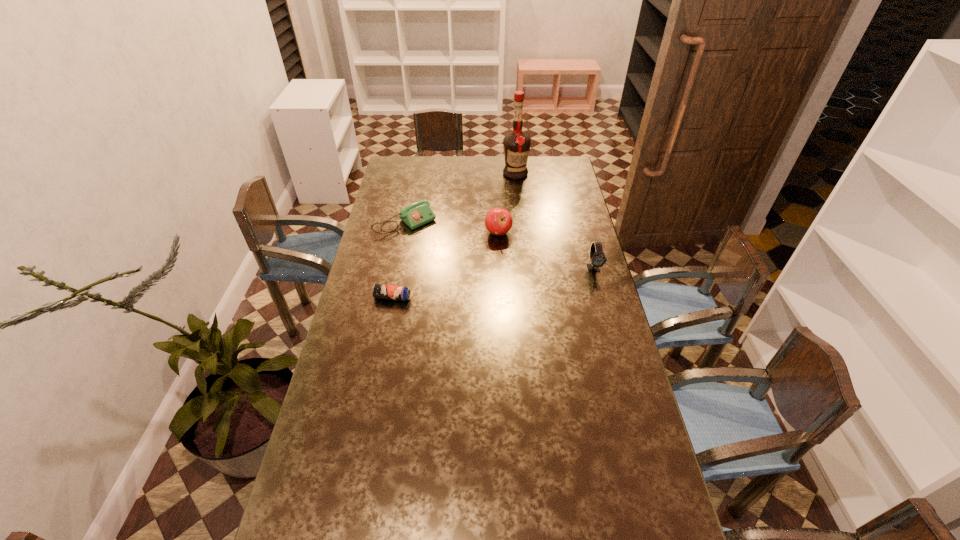
Identify the location of beer can present at the left edge. The height and width of the screenshot is (540, 960). (379, 291).

You are a GUI agent. You are given a task and a screenshot of the screen. Output one action in this format:
    pyautogui.click(x=<x>, y=<y>)
    Task: Click on the telephone present at the left edge
    The image size is (960, 540).
    Given the screenshot: What is the action you would take?
    pyautogui.click(x=414, y=215)

Locate an element on the screen. This screenshot has height=540, width=960. object situated at the right edge is located at coordinates (597, 257).

This screenshot has width=960, height=540. In order to click on free space at the far edge in this screenshot , I will do `click(452, 177)`.

Where is `free point at the near edge`? The width and height of the screenshot is (960, 540). free point at the near edge is located at coordinates (378, 510).

Where is `free space at the left edge of the desktop`? free space at the left edge of the desktop is located at coordinates (x=399, y=267).

You are a GUI agent. You are given a task and a screenshot of the screen. Output one action in this format:
    pyautogui.click(x=<x>, y=<y>)
    Task: Click on the vacant area at the right edge of the desktop
    
    Given the screenshot: What is the action you would take?
    pyautogui.click(x=601, y=370)

This screenshot has height=540, width=960. Find the location of `free space between the liquor and the shortest object`. free space between the liquor and the shortest object is located at coordinates (454, 235).

What are the coordinates of `vacant space in between the liquor and the telephone` in the screenshot? It's located at (460, 199).

I want to click on free point between the farthest object and the apple, so click(x=507, y=204).